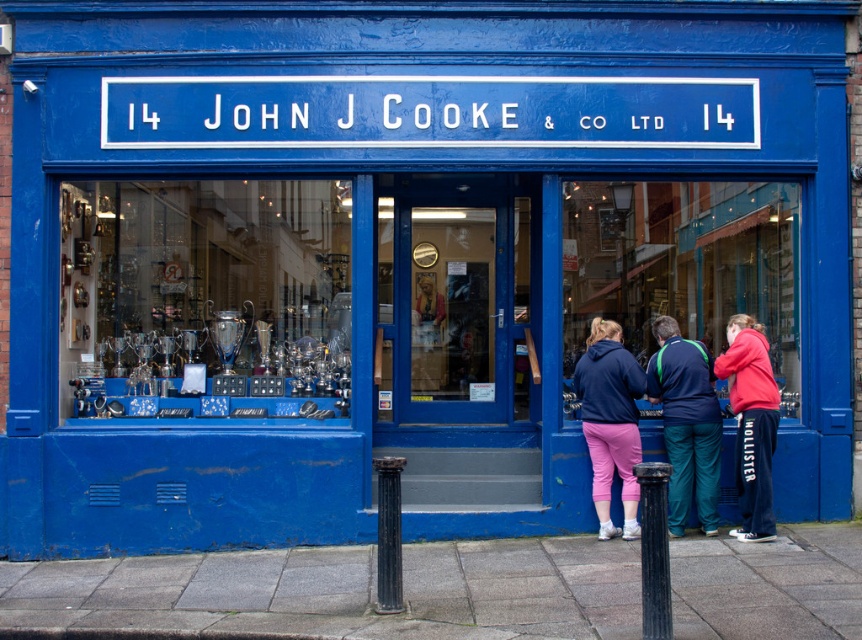
You are standing in front of the storefront of John J Cooke and Co Ltd. You see a black textured pole at lower center and a black metal pole at center. Which pole is located to the right of the other?

The black textured pole at lower center is positioned on the right side of the black metal pole at center.

You are a customer looking at the shop window of John J Cooke Co Ltd. You see a green fabric jacket at center and a pink fleece at lower right. Which item is closer to you?

The green fabric jacket at center is closer to you because the pink fleece at lower right is behind it.

You are a delivery person who needs to place a large package on the ground in front of the shop. The shop has a black textured pole at lower center and a black metal pole at center. Which pole should you avoid placing the package near to ensure it doesn not block the entrance?

You should avoid placing the package near the black metal pole at center because the black textured pole at lower center is positioned over it, meaning the lower pole is closer to the entrance and blocking it would obstruct access.